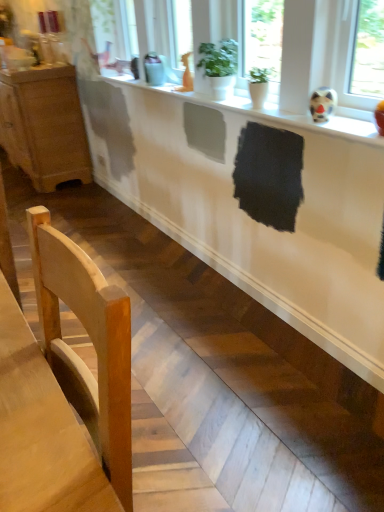
Question: From their relative heights in the image, would you say wooden cabinet at left is taller or shorter than white glossy counter at lower center?

Choices:
 (A) short
 (B) tall

Answer: (B)

Question: Is point (31, 141) positioned closer to the camera than point (342, 265)?

Choices:
 (A) closer
 (B) farther

Answer: (B)

Question: Which object is the closest to the wooden cabinet at left?

Choices:
 (A) green matte plant at upper center
 (B) light wood chair at lower left
 (C) white matte counter top at upper center
 (D) white glossy counter at lower center

Answer: (C)

Question: Which object is positioned farthest from the wooden cabinet at left?

Choices:
 (A) green matte plant at upper center
 (B) white matte counter top at upper center
 (C) white glossy counter at lower center
 (D) light wood chair at lower left

Answer: (D)